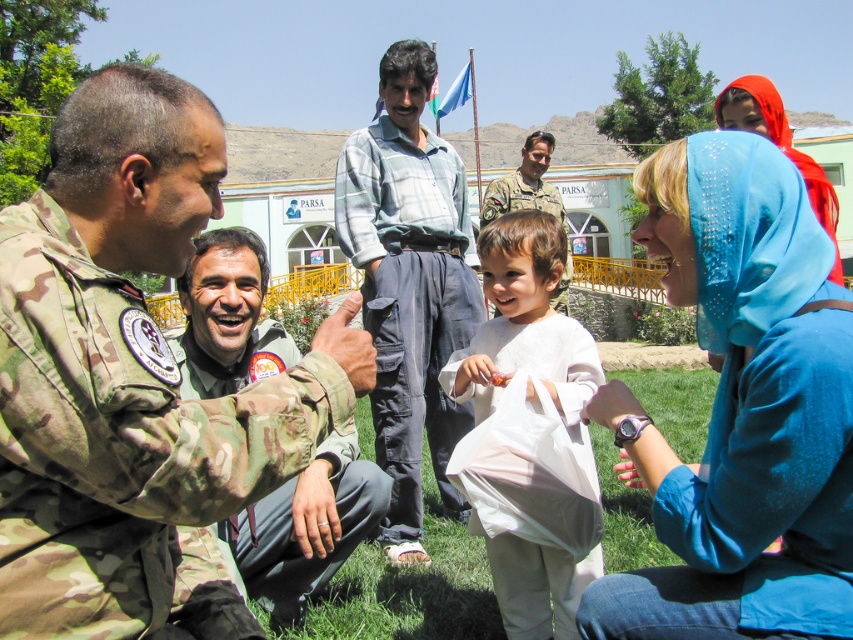
Is light blue plaid shirt at center above blue fabric headscarf at upper right?

Actually, light blue plaid shirt at center is below blue fabric headscarf at upper right.

Does point (416, 474) lie in front of point (766, 100)?

No, it is behind (766, 100).

You are a GUI agent. You are given a task and a screenshot of the screen. Output one action in this format:
    pyautogui.click(x=<x>, y=<y>)
    Task: Click on the light blue plaid shirt at center
    This screenshot has width=853, height=640.
    Given the screenshot: What is the action you would take?
    click(x=409, y=285)

Image resolution: width=853 pixels, height=640 pixels. I want to click on light blue plaid shirt at center, so click(409, 285).

Can you confirm if camo uniform at left is smaller than white cotton shirt at center?

Yes.

Who is higher up, camo uniform at left or white cotton shirt at center?

camo uniform at left is above.

I want to click on camo uniform at left, so click(132, 381).

This screenshot has width=853, height=640. I want to click on camo uniform at left, so click(132, 381).

Who is more distant from viewer, (549, 307) or (758, 90)?

The point (758, 90) is more distant.

Is white cotton shirt at center wider than blue fabric headscarf at upper right?

No.

At what (x,y) coordinates should I click in order to perform the action: click on white cotton shirt at center. Please return your answer as a coordinate pair (x, y). This screenshot has height=640, width=853. Looking at the image, I should click on (527, 330).